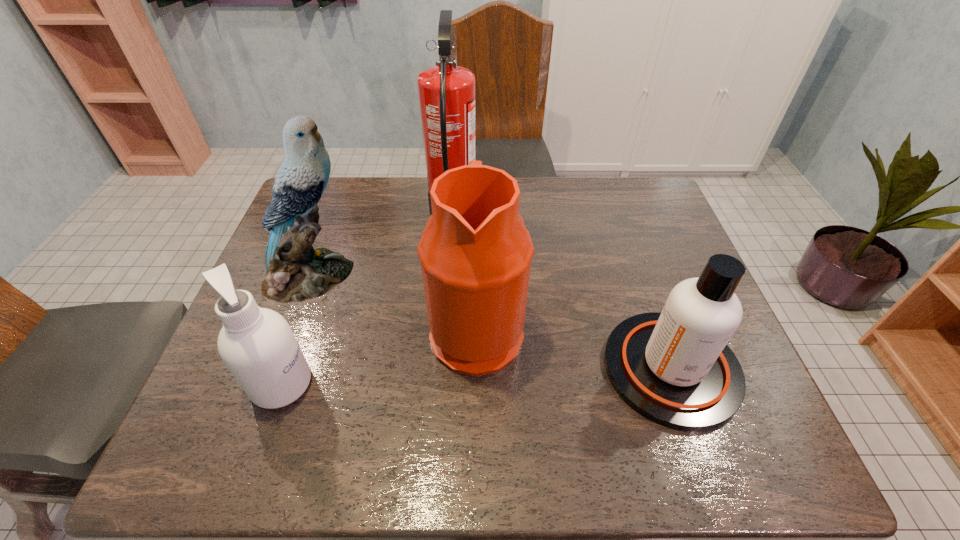
Identify the location of vacant area that lies between the water jug and the rightmost object. The height and width of the screenshot is (540, 960). (574, 349).

Find the location of a particular element. object that is the third closest to the water jug is located at coordinates (x=296, y=272).

In order to click on object that ranks as the second closest to the tallest object in this screenshot , I will do `click(296, 272)`.

At what (x,y) coordinates should I click in order to perform the action: click on vacant region that satisfies the following two spatial constraints: 1. on the front-facing side of the right cleansing agent; 2. on the right side of the tallest object. Please return your answer as a coordinate pair (x, y). This screenshot has width=960, height=540. Looking at the image, I should click on (443, 368).

Locate an element on the screen. The width and height of the screenshot is (960, 540). free space that satisfies the following two spatial constraints: 1. on the face of the right cleansing agent; 2. on the left side of the parakeet is located at coordinates (278, 368).

I want to click on vacant area in the image that satisfies the following two spatial constraints: 1. on the back side of the rightmost object; 2. on the face of the parakeet, so click(x=638, y=276).

Where is `vacant area in the image that satisfies the following two spatial constraints: 1. on the face of the parakeet; 2. on the right side of the rightmost object`? Image resolution: width=960 pixels, height=540 pixels. vacant area in the image that satisfies the following two spatial constraints: 1. on the face of the parakeet; 2. on the right side of the rightmost object is located at coordinates (278, 368).

You are a GUI agent. You are given a task and a screenshot of the screen. Output one action in this format:
    pyautogui.click(x=<x>, y=<y>)
    Task: Click on the vacant space that satisfies the following two spatial constraints: 1. on the face of the parakeet; 2. on the left side of the rightmost object
    This screenshot has height=540, width=960.
    Given the screenshot: What is the action you would take?
    pyautogui.click(x=278, y=368)

Where is `free spot that satisfies the following two spatial constraints: 1. on the face of the parakeet; 2. on the left side of the rightmost object`? free spot that satisfies the following two spatial constraints: 1. on the face of the parakeet; 2. on the left side of the rightmost object is located at coordinates (278, 368).